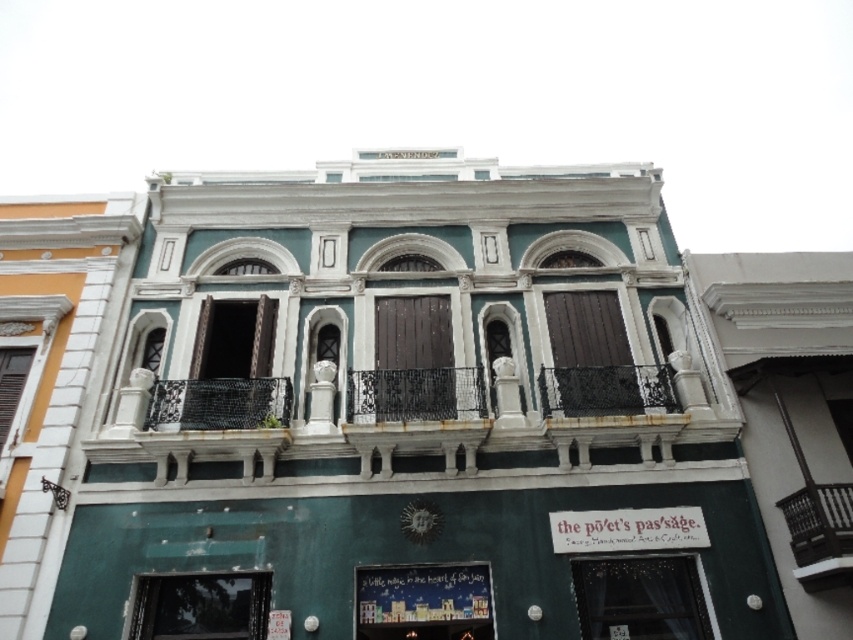
Identify the location of matte glass window at lower center. This screenshot has height=640, width=853. (422, 602).

Which is below, matte glass window at lower center or matte glass window at lower left?

Positioned lower is matte glass window at lower left.

Which is behind, point (395, 624) or point (257, 616)?

Positioned behind is point (257, 616).

You are a GUI agent. You are given a task and a screenshot of the screen. Output one action in this format:
    pyautogui.click(x=<x>, y=<y>)
    Task: Click on the matte glass window at lower center
    The width and height of the screenshot is (853, 640).
    Given the screenshot: What is the action you would take?
    pyautogui.click(x=422, y=602)

Who is more forward, (386, 595) or (809, 538)?

Point (809, 538) is in front.

Is matte glass window at lower center smaller than dark brown wrought iron balcony at center?

Yes, matte glass window at lower center is smaller than dark brown wrought iron balcony at center.

Is point (445, 564) farther from viewer compared to point (839, 586)?

Yes, it is.

Find the location of a particular element. The image size is (853, 640). matte glass window at lower center is located at coordinates (422, 602).

From the picture: Does dark brown wrought iron balcony at center appear on the right side of matte white window at lower left?

Answer: Correct, you'll find dark brown wrought iron balcony at center to the right of matte white window at lower left.

Who is more distant from viewer, (x=804, y=566) or (x=3, y=400)?

The point (x=3, y=400) is behind.

At what (x,y) coordinates should I click in order to perform the action: click on dark brown wrought iron balcony at center. Please return your answer as a coordinate pair (x, y). Looking at the image, I should click on (820, 532).